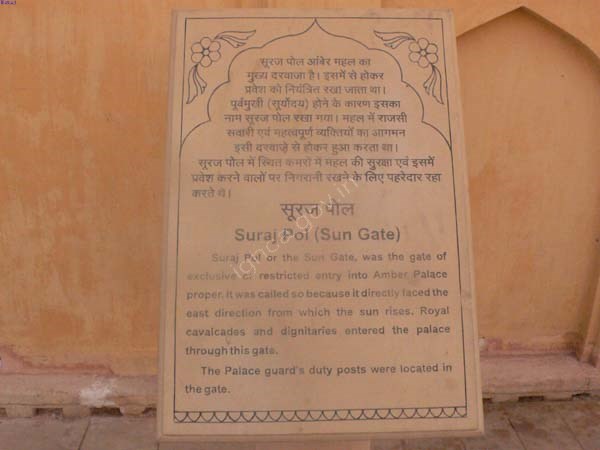
At what (x,y) coordinates should I click in order to perform the action: click on printed plaque border. Please return your answer as a coordinate pair (x, y). Looking at the image, I should click on (176, 215), (302, 16), (455, 215), (305, 421).